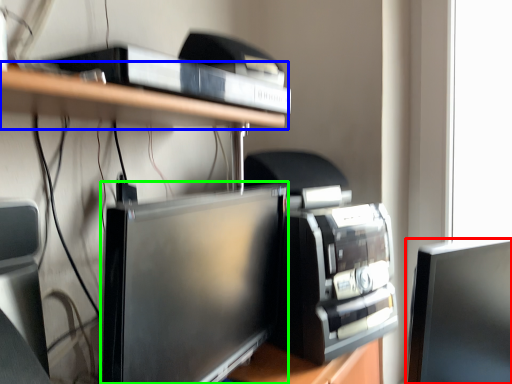
Question: Which object is the closest to the computer monitor (highlighted by a red box)? Choose among these: shelf (highlighted by a blue box) or computer monitor (highlighted by a green box).

Choices:
 (A) shelf
 (B) computer monitor

Answer: (B)